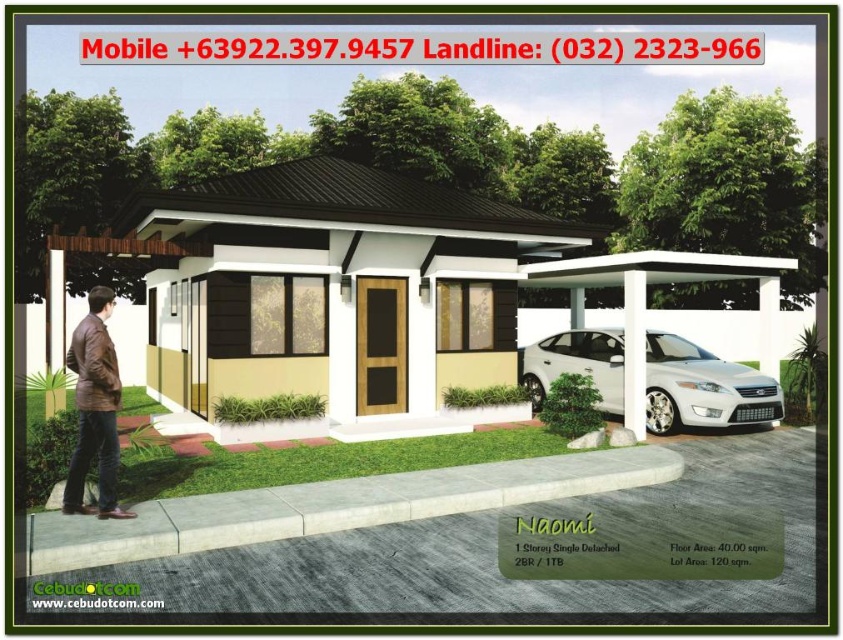
You are a delivery person arriving at Naomi house. You need to place a package on the car but want to avoid the area under the carport. Is the white glossy sedan at center currently under the carport or under the brown leather jacket at lower left?

The white glossy sedan at center is positioned under the brown leather jacket at lower left, so it is under the jacket and not under the carport. Therefore, placing the package there would be under the jacket, not the carport.

You are a delivery person approaching the house and need to park your van behind the white glossy sedan at center and the white smooth pillar at right. Can you safely park your van behind both objects without hitting them?

The white glossy sedan at center is further to the viewer than the white smooth pillar at right, so parking behind both would require positioning the van behind the pillar. However, since the sedan is closer to you, you might not have enough space behind it to park safely. It is advisable to park in front of the sedan instead.

Looking at this image, you are a delivery person approaching the house and see the white glossy sedan at center and the brown leather jacket at lower left. Which object is closer to the front door of the house?

The brown leather jacket at lower left is closer to the front door of the house because the white glossy sedan at center is to the right of it, placing the jacket nearer to the entrance.